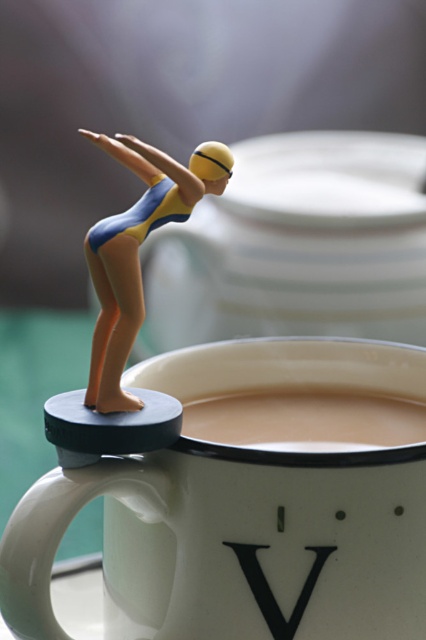
In the scene shown: You are designing a sticker that needs to fit within the space occupied by the black matte letter v at upper center. Can the sticker be placed entirely within the area of the creamy matte coffee at center without overlapping the letter v?

The creamy matte coffee at center might be wider than black matte letter v at upper center, so there is a possibility that the sticker can fit within the coffee area without overlapping the letter v. However, since the exact dimensions aren t specified, it s advisable to check the actual width before placing the sticker.

What is the 2D coordinate of the white ceramic mug at upper center in the image?

The white ceramic mug at upper center is located at the 2D coordinate point of [250,500].

You are designing a label for a new beverage product. The label must include both the creamy matte coffee at center and the black matte letter v at upper center. Given their sizes, which object should you place first to ensure it stands out more?

The creamy matte coffee at center is bigger than the black matte letter v at upper center, so you should place the creamy matte coffee at center first to ensure it stands out more.